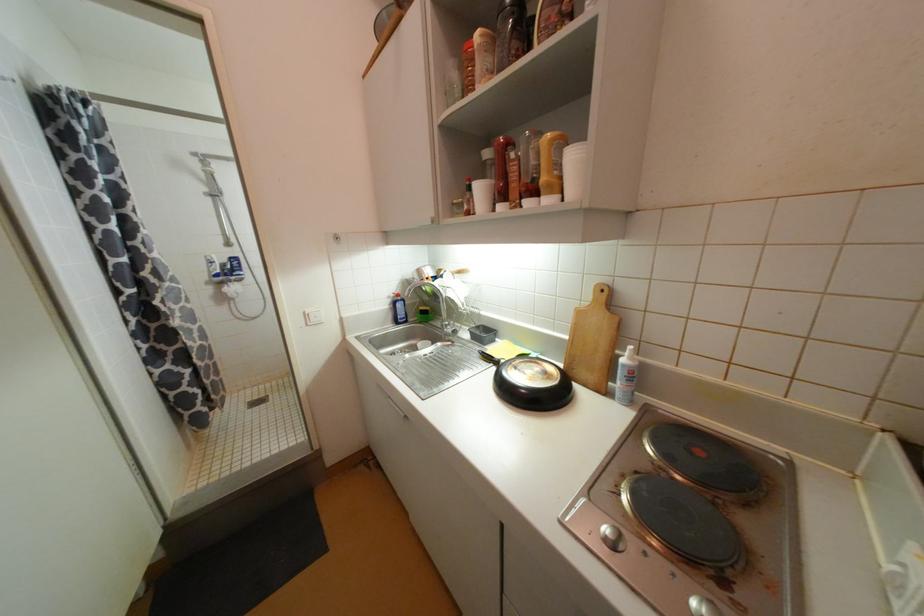
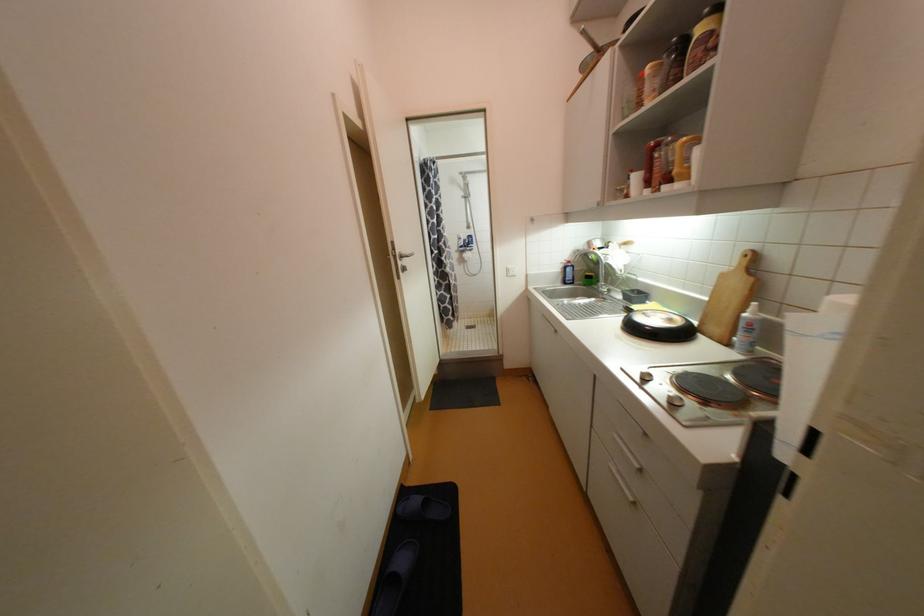
Question: How did the camera likely rotate?

Choices:
 (A) Left
 (B) Right
 (C) Up
 (D) Down

Answer: (A)